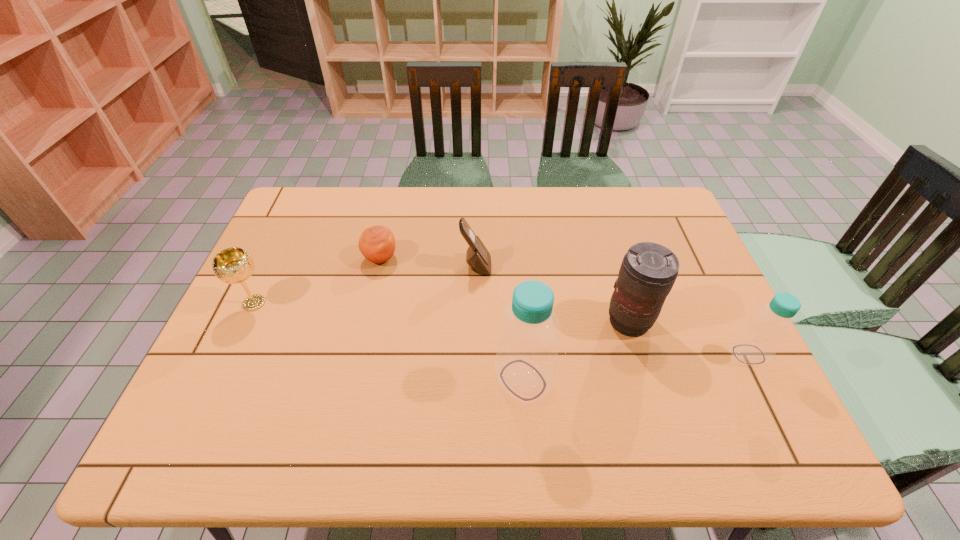
The width and height of the screenshot is (960, 540). I want to click on vacant space at the left edge, so click(x=276, y=232).

Identify the location of vacant area at the right edge of the desktop. (703, 276).

You are a GUI agent. You are given a task and a screenshot of the screen. Output one action in this format:
    pyautogui.click(x=<x>, y=<y>)
    Task: Click on the vacant position at the near left corner of the desktop
    This screenshot has height=540, width=960.
    Given the screenshot: What is the action you would take?
    pyautogui.click(x=253, y=401)

Where is `free space at the far right corner`? The width and height of the screenshot is (960, 540). free space at the far right corner is located at coordinates (642, 193).

You are a GUI agent. You are given a task and a screenshot of the screen. Output one action in this format:
    pyautogui.click(x=<x>, y=<y>)
    Task: Click on the free space between the shortest object and the taller bottle
    
    Given the screenshot: What is the action you would take?
    pyautogui.click(x=451, y=319)

Where is `vacant space that's between the cellular telephone and the tallest object`? This screenshot has width=960, height=540. vacant space that's between the cellular telephone and the tallest object is located at coordinates (499, 323).

What are the coordinates of `empty space between the chalice and the shortest object` in the screenshot? It's located at (317, 281).

This screenshot has width=960, height=540. Find the location of `empty space that is in between the cellular telephone and the leftmost object`. empty space that is in between the cellular telephone and the leftmost object is located at coordinates (365, 285).

Identify the location of unoccupied position between the telephoto lens and the left bottle. This screenshot has height=540, width=960. (576, 351).

This screenshot has height=540, width=960. Find the location of `free point between the left bottle and the cellular telephone`. free point between the left bottle and the cellular telephone is located at coordinates (499, 323).